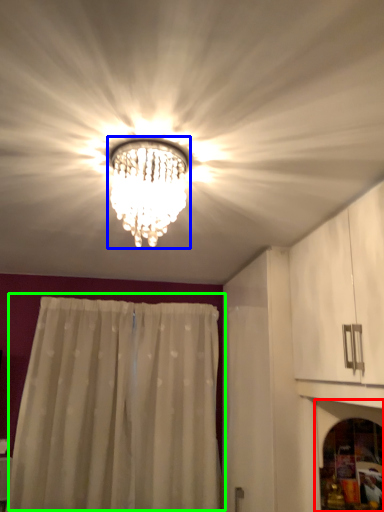
Question: Which object is the farthest from screen door (highlighted by a red box)? Choose among these: lamp (highlighted by a blue box) or curtain (highlighted by a green box).

Choices:
 (A) lamp
 (B) curtain

Answer: (B)